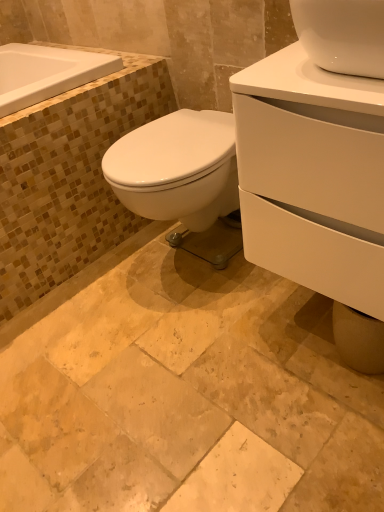
Question: Considering the relative sizes of natural stone tile at center and white glossy cabinet at right in the image provided, is natural stone tile at center shorter than white glossy cabinet at right?

Choices:
 (A) yes
 (B) no

Answer: (A)

Question: Does natural stone tile at center appear on the right side of white glossy cabinet at right?

Choices:
 (A) yes
 (B) no

Answer: (B)

Question: Considering the relative sizes of natural stone tile at center and white glossy cabinet at right in the image provided, is natural stone tile at center bigger than white glossy cabinet at right?

Choices:
 (A) no
 (B) yes

Answer: (A)

Question: From the image's perspective, does natural stone tile at center appear lower than white glossy cabinet at right?

Choices:
 (A) no
 (B) yes

Answer: (B)

Question: From a real-world perspective, is natural stone tile at center physically above white glossy cabinet at right?

Choices:
 (A) no
 (B) yes

Answer: (A)

Question: Is white glossy cabinet at right inside the boundaries of white glossy bathtub at upper left, or outside?

Choices:
 (A) outside
 (B) inside

Answer: (A)

Question: Based on their positions, is white glossy cabinet at right located to the left or right of white glossy bathtub at upper left?

Choices:
 (A) left
 (B) right

Answer: (B)

Question: From a real-world perspective, is white glossy cabinet at right physically located above or below white glossy bathtub at upper left?

Choices:
 (A) above
 (B) below

Answer: (B)

Question: Considering the positions of white glossy cabinet at right and white glossy bathtub at upper left in the image, is white glossy cabinet at right taller or shorter than white glossy bathtub at upper left?

Choices:
 (A) tall
 (B) short

Answer: (A)

Question: Based on their positions, is natural stone tile at center located to the left or right of white glossy bathtub at upper left?

Choices:
 (A) right
 (B) left

Answer: (A)

Question: Considering the positions of natural stone tile at center and white glossy bathtub at upper left in the image, is natural stone tile at center wider or thinner than white glossy bathtub at upper left?

Choices:
 (A) wide
 (B) thin

Answer: (A)

Question: From the image's perspective, is natural stone tile at center positioned above or below white glossy bathtub at upper left?

Choices:
 (A) below
 (B) above

Answer: (A)

Question: Is natural stone tile at center bigger or smaller than white glossy bathtub at upper left?

Choices:
 (A) big
 (B) small

Answer: (A)

Question: Is natural stone tile at center in front of or behind white glossy cabinet at right in the image?

Choices:
 (A) front
 (B) behind

Answer: (A)

Question: From a real-world perspective, relative to white glossy cabinet at right, is natural stone tile at center vertically above or below?

Choices:
 (A) above
 (B) below

Answer: (B)